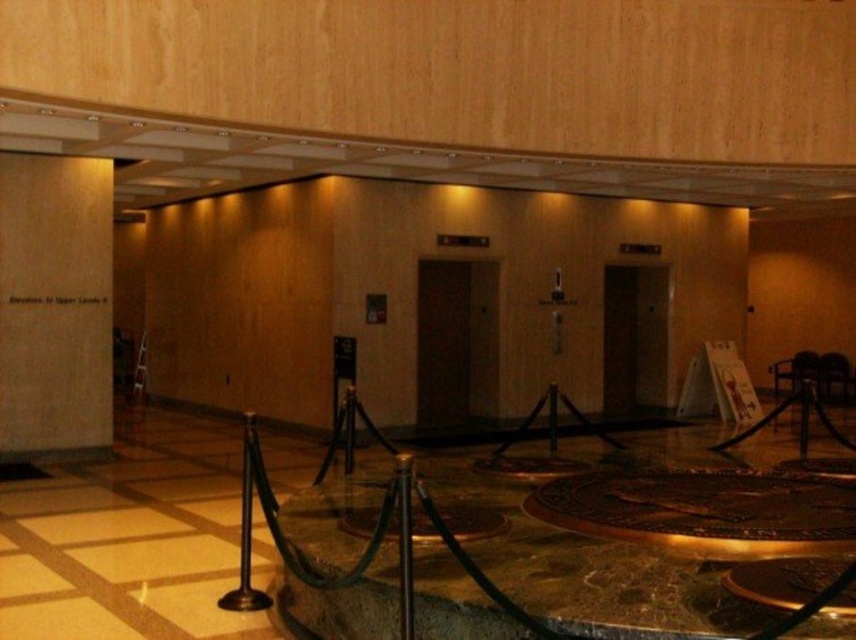
Does wooden sign at left come behind metallic pole at center?

Yes, wooden sign at left is further from the viewer.

Is point (110, 369) positioned in front of point (406, 461)?

No, (110, 369) is behind (406, 461).

I want to click on wooden sign at left, so click(54, 304).

Which is in front, point (72, 320) or point (248, 451)?

Point (248, 451) is more forward.

Between point (34, 157) and point (244, 602), which one is positioned behind?

The point (34, 157) is more distant.

The image size is (856, 640). I want to click on wooden sign at left, so click(x=54, y=304).

Can you confirm if brown metallic pole at center is wider than metallic pole at center?

Correct, the width of brown metallic pole at center exceeds that of metallic pole at center.

Describe the element at coordinates (245, 531) in the screenshot. I see `brown metallic pole at center` at that location.

Which is in front, point (241, 557) or point (412, 636)?

Point (412, 636)

Locate an element on the screen. brown metallic pole at center is located at coordinates (245, 531).